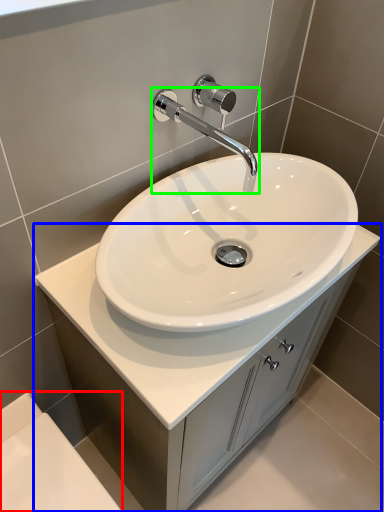
Question: Considering the real-world distances, which object is closest to bath (highlighted by a red box)? bathroom cabinet (highlighted by a blue box) or tap (highlighted by a green box).

Choices:
 (A) bathroom cabinet
 (B) tap

Answer: (A)